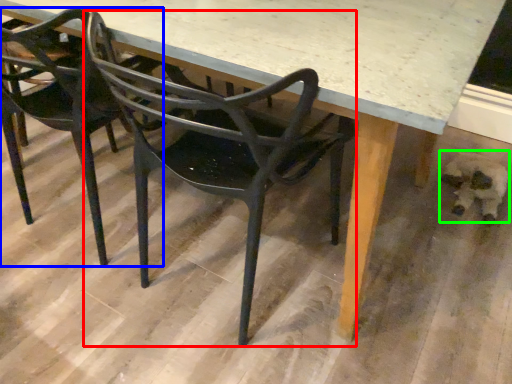
Question: Which object is positioned farthest from chair (highlighted by a red box)? Select from chair (highlighted by a blue box) and animal (highlighted by a green box).

Choices:
 (A) chair
 (B) animal

Answer: (B)